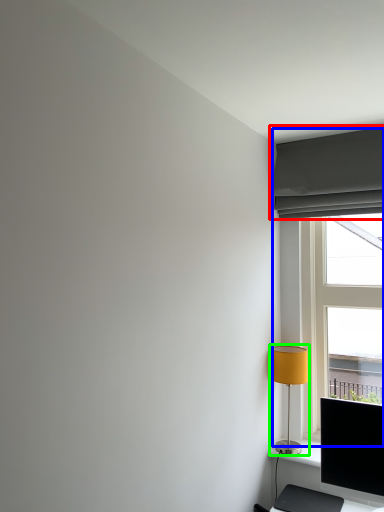
Question: Which object is positioned closest to curtain (highlighted by a red box)? Select from window (highlighted by a blue box) and lamp (highlighted by a green box).

Choices:
 (A) window
 (B) lamp

Answer: (A)